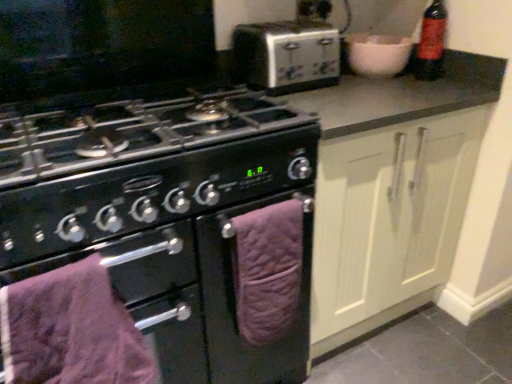
Question: Is the depth of purple quilted towel at lower center, the first oven viewed from the right, greater than that of black matte oven at center, which is counted as the 2th oven, starting from the right?

Choices:
 (A) yes
 (B) no

Answer: (A)

Question: Would you say purple quilted towel at lower center, the 2th oven viewed from the left, is a long distance from black matte oven at center, which is counted as the 2th oven, starting from the right?

Choices:
 (A) no
 (B) yes

Answer: (A)

Question: Is purple quilted towel at lower center, the first oven viewed from the right, turned away from black matte oven at center, which is counted as the 2th oven, starting from the right?

Choices:
 (A) yes
 (B) no

Answer: (A)

Question: Is purple quilted towel at lower center, the 2th oven viewed from the left, directly adjacent to black matte oven at center, positioned as the 1th oven in left-to-right order?

Choices:
 (A) yes
 (B) no

Answer: (A)

Question: Could black matte oven at center, positioned as the 1th oven in left-to-right order, be considered to be inside purple quilted towel at lower center, the 2th oven viewed from the left?

Choices:
 (A) no
 (B) yes

Answer: (A)

Question: Can you confirm if purple quilted towel at lower center, the first oven viewed from the right, is taller than black matte oven at center, positioned as the 1th oven in left-to-right order?

Choices:
 (A) no
 (B) yes

Answer: (A)

Question: Would you consider red matte bottle at upper right to be distant from black matte oven at center, positioned as the 1th oven in left-to-right order?

Choices:
 (A) no
 (B) yes

Answer: (A)

Question: Is red matte bottle at upper right positioned before black matte oven at center, positioned as the 1th oven in left-to-right order?

Choices:
 (A) yes
 (B) no

Answer: (B)

Question: Is red matte bottle at upper right positioned beyond the bounds of black matte oven at center, positioned as the 1th oven in left-to-right order?

Choices:
 (A) no
 (B) yes

Answer: (B)

Question: From the image's perspective, does red matte bottle at upper right appear higher than black matte oven at center, positioned as the 1th oven in left-to-right order?

Choices:
 (A) no
 (B) yes

Answer: (B)

Question: Can you confirm if red matte bottle at upper right is positioned to the right of black matte oven at center, which is counted as the 2th oven, starting from the right?

Choices:
 (A) no
 (B) yes

Answer: (B)

Question: Does red matte bottle at upper right have a lesser height compared to black matte oven at center, which is counted as the 2th oven, starting from the right?

Choices:
 (A) yes
 (B) no

Answer: (A)

Question: Can you confirm if silver metallic toaster at upper center is taller than purple quilted towel at lower center, the first oven viewed from the right?

Choices:
 (A) no
 (B) yes

Answer: (A)